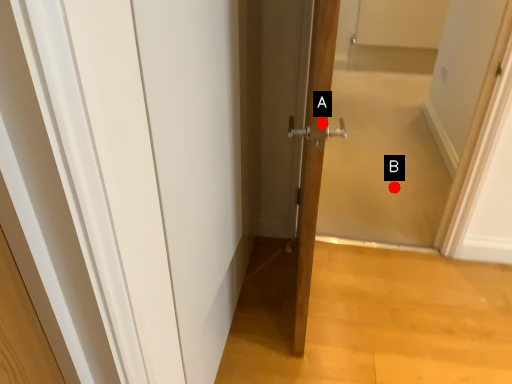
Question: Two points are circled on the image, labeled by A and B beside each circle. Which point appears farthest from the camera in this image?

Choices:
 (A) A is further
 (B) B is further

Answer: (B)